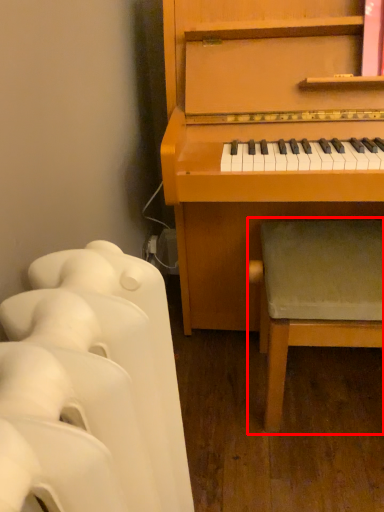
Question: Considering the relative positions of music stool (annotated by the red box) and furniture in the image provided, where is music stool (annotated by the red box) located with respect to the staircase?

Choices:
 (A) left
 (B) right

Answer: (B)